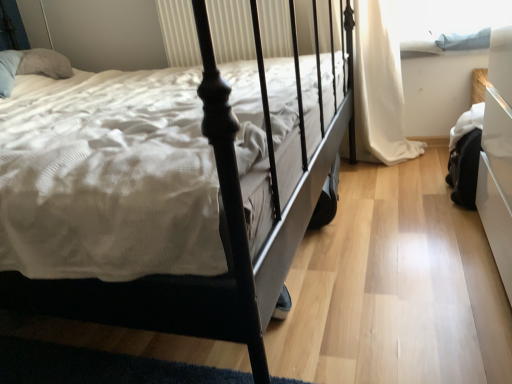
Describe the element at coordinates (227, 229) in the screenshot. The height and width of the screenshot is (384, 512). I see `matte black bed at center` at that location.

Measure the distance between white fabric curtain at right and camera.

They are 6.41 feet apart.

What do you see at coordinates (379, 86) in the screenshot?
I see `white fabric curtain at right` at bounding box center [379, 86].

The width and height of the screenshot is (512, 384). I want to click on blue fabric at upper right, so click(x=446, y=21).

I want to click on matte black bed at center, so click(x=227, y=229).

Is blue fabric at upper right next to matte black bed at center and touching it?

They are not placed beside each other.

Between blue fabric at upper right and matte black bed at center, which one has smaller width?

blue fabric at upper right is thinner.

Measure the distance between blue fabric at upper right and matte black bed at center.

The distance of blue fabric at upper right from matte black bed at center is 33.33 inches.

At what (x,y) coordinates should I click in order to perform the action: click on window screen that appears on the right of matte black bed at center. Please return your answer as a coordinate pair (x, y). Looking at the image, I should click on (446, 21).

Is white fabric curtain at right at the left side of matte black bed at center?

In fact, white fabric curtain at right is to the right of matte black bed at center.

In terms of width, does white fabric curtain at right look wider or thinner when compared to matte black bed at center?

white fabric curtain at right is thinner than matte black bed at center.

Could you tell me if white fabric curtain at right is turned towards matte black bed at center?

No, white fabric curtain at right does not turn towards matte black bed at center.

Is point (369, 82) farther from viewer compared to point (224, 101)?

Yes, it is.

Based on their positions, is blue fabric at upper right located to the left or right of white fabric curtain at right?

blue fabric at upper right is positioned on white fabric curtain at right's right side.

In terms of size, does blue fabric at upper right appear bigger or smaller than white fabric curtain at right?

In the image, blue fabric at upper right appears to be smaller than white fabric curtain at right.

The image size is (512, 384). I want to click on window screen above the white fabric curtain at right (from the image's perspective), so click(x=446, y=21).

In the scene shown: Relative to white fabric curtain at right, is blue fabric at upper right in front or behind?

Clearly, blue fabric at upper right is behind white fabric curtain at right.

Image resolution: width=512 pixels, height=384 pixels. Find the location of `window screen on the right of the white fabric curtain at right`. window screen on the right of the white fabric curtain at right is located at coordinates (446, 21).

Is white fabric curtain at right facing towards blue fabric at upper right?

No, white fabric curtain at right does not turn towards blue fabric at upper right.

Considering the relative sizes of white fabric curtain at right and blue fabric at upper right in the image provided, is white fabric curtain at right smaller than blue fabric at upper right?

No, white fabric curtain at right is not smaller than blue fabric at upper right.

Between matte black bed at center and blue fabric at upper right, which one has larger width?

Wider between the two is matte black bed at center.

Considering the relative positions of matte black bed at center and blue fabric at upper right in the image provided, is matte black bed at center to the left or to the right of blue fabric at upper right?

From the image, it's evident that matte black bed at center is to the left of blue fabric at upper right.

The image size is (512, 384). I want to click on bed below the blue fabric at upper right (from the image's perspective), so pos(227,229).

Are matte black bed at center and white fabric curtain at right far apart?

No, matte black bed at center is not far from white fabric curtain at right.

Is point (53, 292) in front of point (422, 146)?

Yes, it is.

From the image's perspective, is matte black bed at center above or below white fabric curtain at right?

Based on their image positions, matte black bed at center is located beneath white fabric curtain at right.

You are a GUI agent. You are given a task and a screenshot of the screen. Output one action in this format:
    pyautogui.click(x=<x>, y=<y>)
    Task: Click on the bed on the left of blue fabric at upper right
    The height and width of the screenshot is (384, 512).
    Given the screenshot: What is the action you would take?
    pyautogui.click(x=227, y=229)

Where is `curtain located behind the matte black bed at center`? The image size is (512, 384). curtain located behind the matte black bed at center is located at coordinates (379, 86).

From the image, which object appears to be nearer to white fabric curtain at right, matte black bed at center or blue fabric at upper right?

blue fabric at upper right.

Which object lies nearer to the anchor point blue fabric at upper right, matte black bed at center or white fabric curtain at right?

white fabric curtain at right is positioned closer to the anchor blue fabric at upper right.

Consider the image. Which object lies further to the anchor point matte black bed at center, blue fabric at upper right or white fabric curtain at right?

blue fabric at upper right.

From the image, which object appears to be farther from blue fabric at upper right, white fabric curtain at right or matte black bed at center?

Based on the image, matte black bed at center appears to be further to blue fabric at upper right.

Estimate the real-world distances between objects in this image. Which object is further from matte black bed at center, white fabric curtain at right or blue fabric at upper right?

blue fabric at upper right is further to matte black bed at center.

Considering their positions, is blue fabric at upper right positioned closer to white fabric curtain at right than matte black bed at center?

blue fabric at upper right.

Identify the location of curtain between matte black bed at center and blue fabric at upper right. (379, 86).